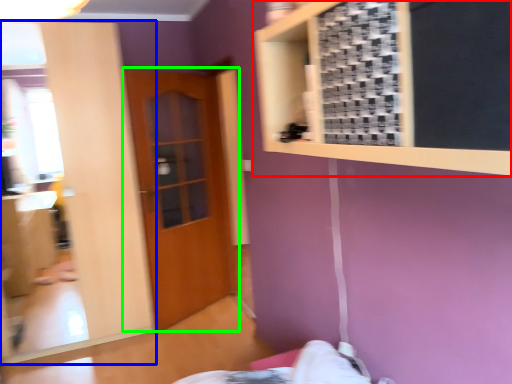
Question: Considering the real-world distances, which object is farthest from bulletin board (highlighted by a red box)? mirror (highlighted by a blue box) or door (highlighted by a green box)?

Choices:
 (A) mirror
 (B) door

Answer: (B)